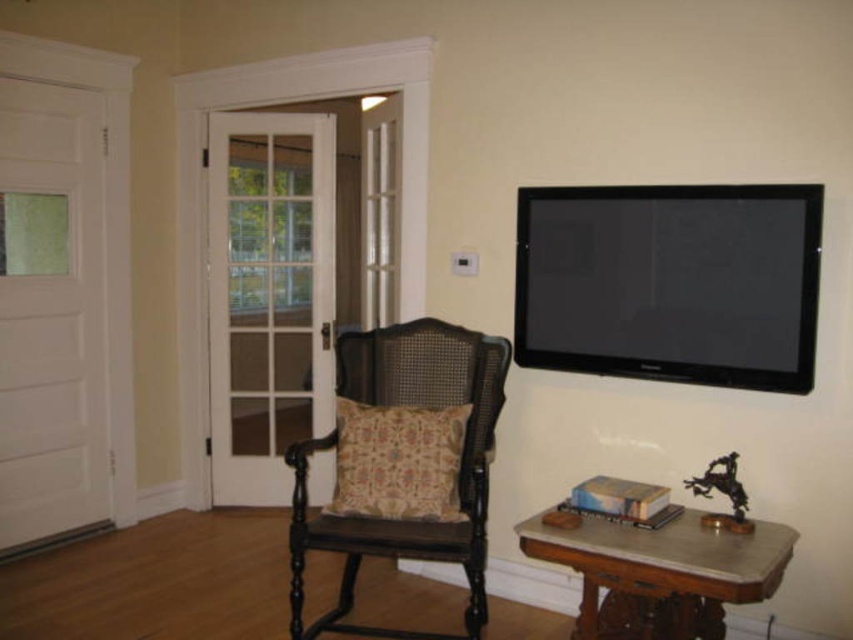
Who is more forward, (538, 193) or (479, 579)?

Point (479, 579) is more forward.

Does point (746, 216) come closer to viewer compared to point (351, 557)?

Yes, it is.

Is point (584, 371) behind point (418, 356)?

No, it is not.

This screenshot has height=640, width=853. Identify the location of flat screen tv at upper right. (670, 282).

Can you confirm if matte black wooden rocking chair at center is thinner than brown wood table at lower right?

Yes, matte black wooden rocking chair at center is thinner than brown wood table at lower right.

Does point (445, 362) lie behind point (647, 636)?

Yes, point (445, 362) is behind point (647, 636).

Identify the location of matte black wooden rocking chair at center. The height and width of the screenshot is (640, 853). (456, 481).

Is point (722, 186) behind point (621, 634)?

Yes, point (722, 186) is farther from viewer.

What do you see at coordinates (670, 282) in the screenshot? I see `flat screen tv at upper right` at bounding box center [670, 282].

The height and width of the screenshot is (640, 853). What are the coordinates of `flat screen tv at upper right` in the screenshot? It's located at (670, 282).

This screenshot has width=853, height=640. What are the coordinates of `flat screen tv at upper right` in the screenshot? It's located at (670, 282).